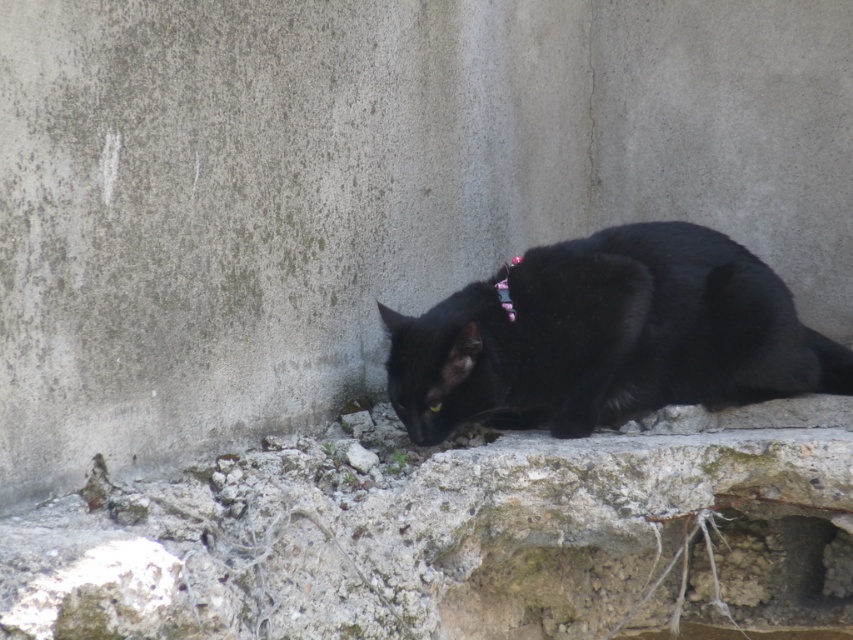
Can you confirm if rough concrete wall at lower center is positioned to the right of pink fabric neckband at center?

Incorrect, rough concrete wall at lower center is not on the right side of pink fabric neckband at center.

Can you confirm if rough concrete wall at lower center is positioned above pink fabric neckband at center?

No.

What do you see at coordinates (457, 534) in the screenshot?
I see `rough concrete wall at lower center` at bounding box center [457, 534].

Where is `rough concrete wall at lower center`? The height and width of the screenshot is (640, 853). rough concrete wall at lower center is located at coordinates coord(457,534).

Which is more to the left, rough concrete wall at lower center or black fur cat at lower right?

rough concrete wall at lower center

Is rough concrete wall at lower center wider than black fur cat at lower right?

Correct, the width of rough concrete wall at lower center exceeds that of black fur cat at lower right.

Image resolution: width=853 pixels, height=640 pixels. Describe the element at coordinates (457, 534) in the screenshot. I see `rough concrete wall at lower center` at that location.

Locate an element on the screen. rough concrete wall at lower center is located at coordinates (457, 534).

Can you confirm if black fur cat at lower right is wider than pink fabric neckband at center?

Correct, the width of black fur cat at lower right exceeds that of pink fabric neckband at center.

Is black fur cat at lower right above pink fabric neckband at center?

No, black fur cat at lower right is not above pink fabric neckband at center.

At what (x,y) coordinates should I click in order to perform the action: click on black fur cat at lower right. Please return your answer as a coordinate pair (x, y). The width and height of the screenshot is (853, 640). Looking at the image, I should click on (607, 337).